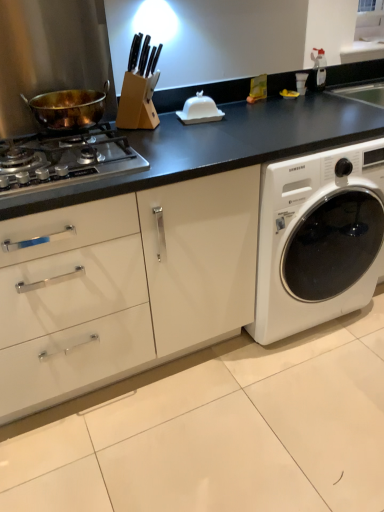
Question: Can we say white glossy butter dish at center lies outside white matte washing machine at center-right?

Choices:
 (A) yes
 (B) no

Answer: (A)

Question: Does white glossy butter dish at center have a smaller size compared to white matte washing machine at center-right?

Choices:
 (A) no
 (B) yes

Answer: (B)

Question: Could you tell me if white glossy butter dish at center is turned towards white matte washing machine at center-right?

Choices:
 (A) yes
 (B) no

Answer: (B)

Question: Does white glossy butter dish at center come behind white matte washing machine at center-right?

Choices:
 (A) no
 (B) yes

Answer: (B)

Question: Are white glossy butter dish at center and white matte washing machine at center-right far apart?

Choices:
 (A) no
 (B) yes

Answer: (A)

Question: Is white matte washing machine at center-right situated inside stainless steel gas stove at left or outside?

Choices:
 (A) outside
 (B) inside

Answer: (A)

Question: From a real-world perspective, is white matte washing machine at center-right positioned above or below stainless steel gas stove at left?

Choices:
 (A) above
 (B) below

Answer: (B)

Question: Would you say white matte washing machine at center-right is to the left or to the right of stainless steel gas stove at left in the picture?

Choices:
 (A) right
 (B) left

Answer: (A)

Question: From their relative heights in the image, would you say white matte washing machine at center-right is taller or shorter than stainless steel gas stove at left?

Choices:
 (A) short
 (B) tall

Answer: (B)

Question: In terms of width, does white glossy butter dish at center look wider or thinner when compared to gold-bronze wok at left?

Choices:
 (A) thin
 (B) wide

Answer: (A)

Question: Is white glossy butter dish at center in front of or behind gold-bronze wok at left in the image?

Choices:
 (A) front
 (B) behind

Answer: (B)

Question: Is point (195, 95) positioned closer to the camera than point (52, 106)?

Choices:
 (A) farther
 (B) closer

Answer: (A)

Question: From the image's perspective, is white glossy butter dish at center above or below gold-bronze wok at left?

Choices:
 (A) below
 (B) above

Answer: (B)

Question: In the image, is white matte washing machine at center-right on the left side or the right side of gold-bronze wok at left?

Choices:
 (A) left
 (B) right

Answer: (B)

Question: From the image's perspective, is white matte washing machine at center-right located above or below gold-bronze wok at left?

Choices:
 (A) below
 (B) above

Answer: (A)